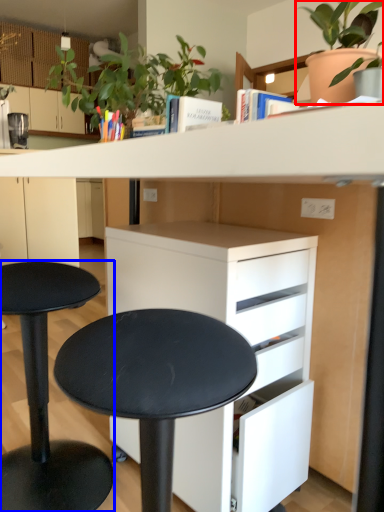
Question: Among these objects, which one is farthest to the camera, houseplant (highlighted by a red box) or stool (highlighted by a blue box)?

Choices:
 (A) houseplant
 (B) stool

Answer: (A)